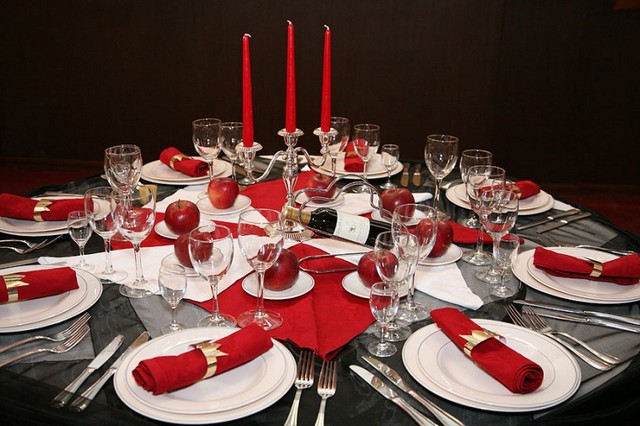
Find the location of a particular element. The image size is (640, 426). red napkins is located at coordinates (179, 367), (45, 284), (19, 204), (194, 164), (355, 160), (521, 188), (569, 265), (521, 372).